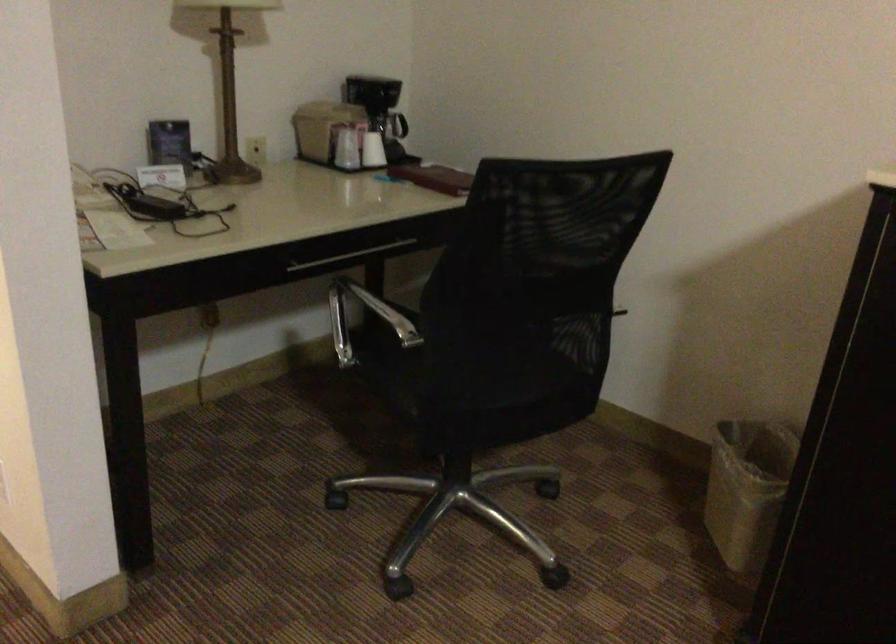
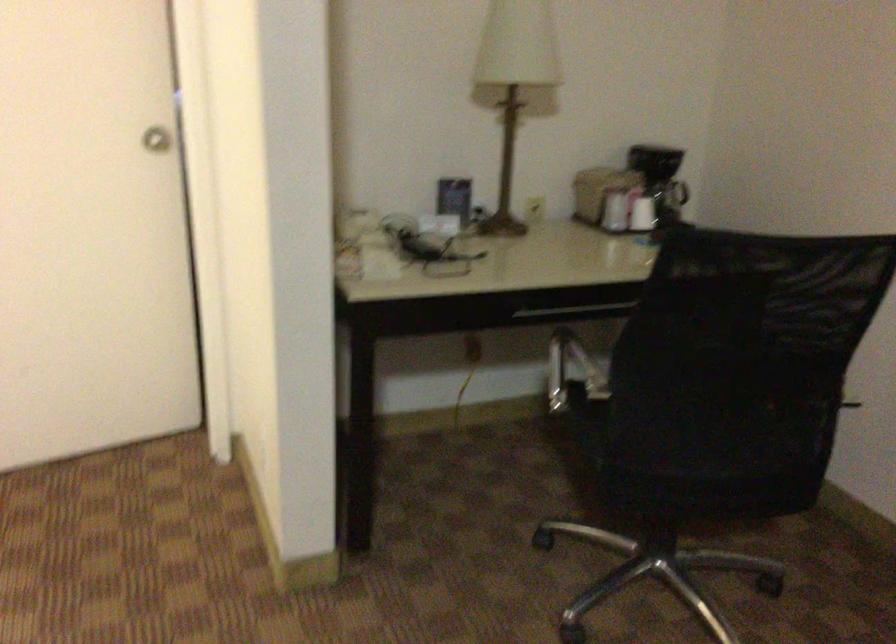
Locate, in the second image, the point that corresponds to (328,129) in the first image.

(599, 190)